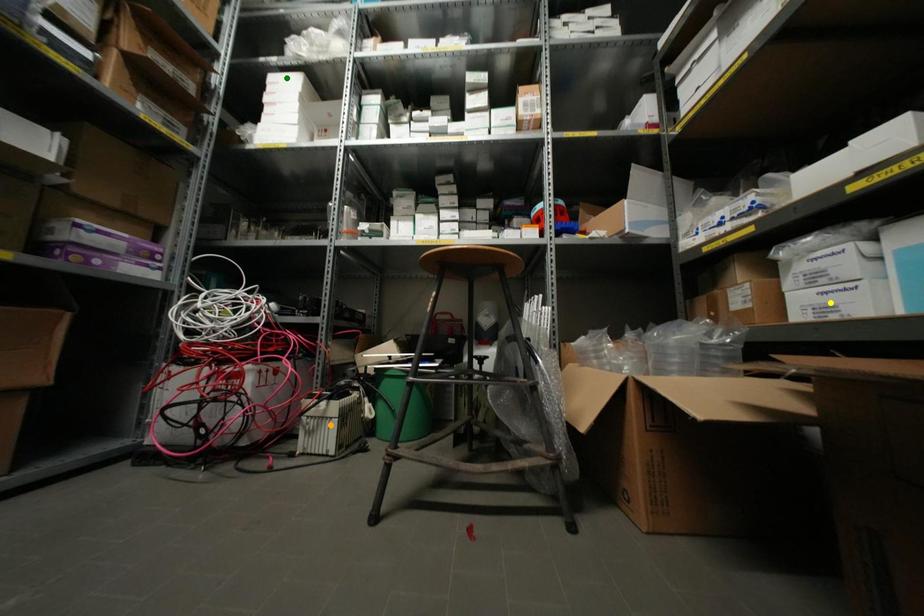
Order these from nearest to farthest:
yellow point | orange point | green point

1. green point
2. orange point
3. yellow point